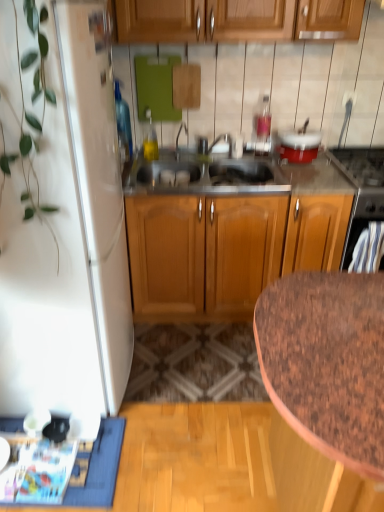
At what (x,y) coordinates should I click in order to perform the action: click on free location above brown speckled granite at lower right (from a real-world perspective). Please return your answer as a coordinate pair (x, y). This screenshot has height=512, width=384. Looking at the image, I should click on (336, 339).